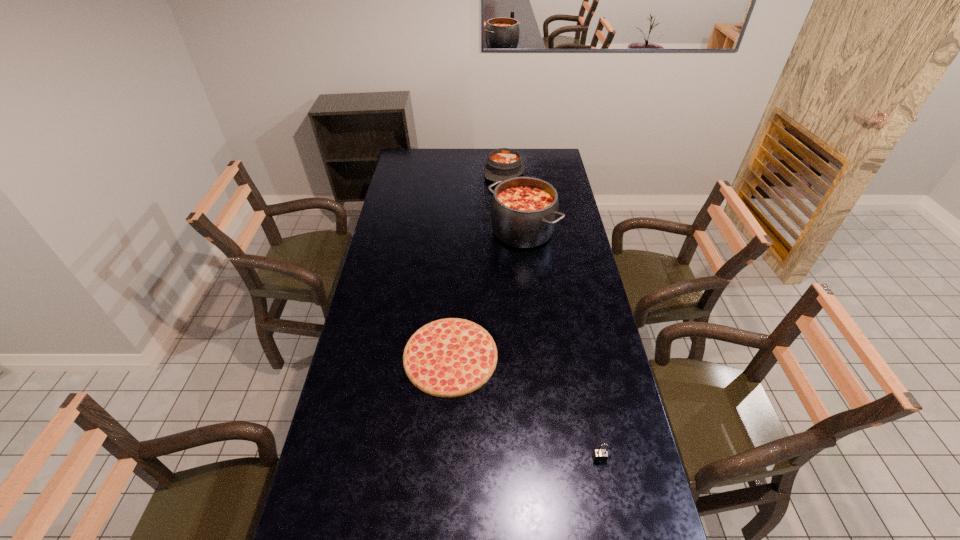
Identify the location of vacant space located on the front of the shortest object. This screenshot has width=960, height=540. (445, 440).

This screenshot has width=960, height=540. I want to click on object positioned at the far edge, so [504, 163].

The width and height of the screenshot is (960, 540). Find the location of `casserole located at the right edge`. casserole located at the right edge is located at coordinates (524, 210).

At what (x,y) coordinates should I click in order to perform the action: click on padlock at the right edge. Please return your answer as a coordinate pair (x, y). Looking at the image, I should click on click(x=600, y=455).

Identify the location of vacant space at the far edge of the desktop. This screenshot has width=960, height=540. (484, 155).

The image size is (960, 540). I want to click on vacant area at the left edge of the desktop, so click(372, 395).

Find the location of a particular element. This screenshot has width=960, height=540. free space at the right edge of the desktop is located at coordinates click(566, 190).

Find the location of a particular element. This screenshot has width=960, height=540. free space at the far left corner is located at coordinates (407, 170).

Locate an element on the screen. vacant area that lies between the third nearest object and the nearest object is located at coordinates (561, 345).

Image resolution: width=960 pixels, height=540 pixels. I want to click on unoccupied position between the nearest object and the nearer casserole, so click(561, 345).